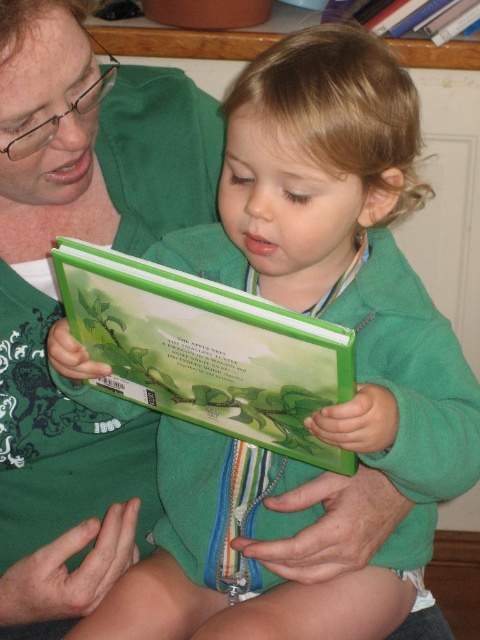
Who is higher up, green matte book at upper left or green matte book at upper center?

green matte book at upper center is above.

The width and height of the screenshot is (480, 640). I want to click on green matte book at upper left, so click(x=59, y=300).

Find the location of `green matte book at upper left`. green matte book at upper left is located at coordinates (59, 300).

Looking at this image, between green matte book at upper left and green matte book at center, which one appears on the left side from the viewer's perspective?

From the viewer's perspective, green matte book at upper left appears more on the left side.

Does point (104, 100) come farther from viewer compared to point (264, 436)?

Yes, it is.

Where is `green matte book at upper left`? green matte book at upper left is located at coordinates (59, 300).

Who is positioned more to the right, green matte book at center or green matte book at upper center?

green matte book at upper center is more to the right.

Is green matte book at center positioned behind green matte book at upper center?

No, green matte book at center is in front of green matte book at upper center.

Between point (79, 282) and point (445, 36), which one is positioned behind?

Point (445, 36)

You are a GUI agent. You are given a task and a screenshot of the screen. Output one action in this format:
    pyautogui.click(x=<x>, y=<y>)
    Task: Click on the green matte book at center
    
    Given the screenshot: What is the action you would take?
    point(206,349)